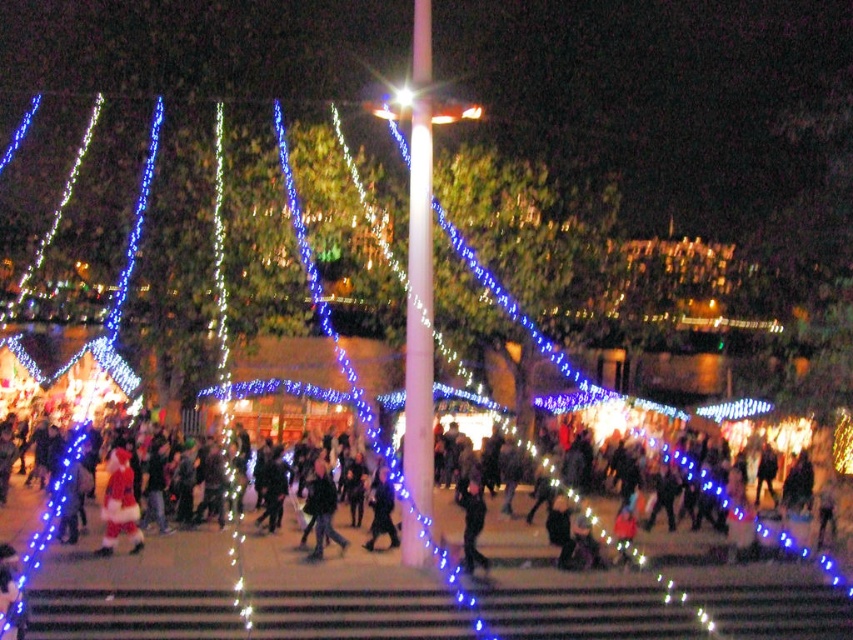
You are a photographer standing at the edge of the scene. You notice the dark clothing crowd at center and the dark blue jeans at center. Which group is taller?

The dark clothing crowd at center has a greater height compared to the dark blue jeans at center, so the dark clothing crowd at center is taller.

You are walking on the striped pavement near the white pole and want to reach the blue and white lights. Which direction should you move relative to the dark clothing crowd at center and dark blue jeans at center?

The dark clothing crowd at center is to the left of dark blue jeans at center. To reach the blue and white lights, you should move to the right of the dark blue jeans at center since they are positioned towards the left of the crowd, and the lights are likely in the opposite direction of the crowd towards the poles and trees.

Based on the photo, you are standing at the entrance of the market and see the dark gray jacket at center. If you want to move towards it, which direction should you walk relative to the white pole in the foreground?

The dark gray jacket at center is located at point [321,509], so you should walk towards the center area away from the white pole in the foreground.